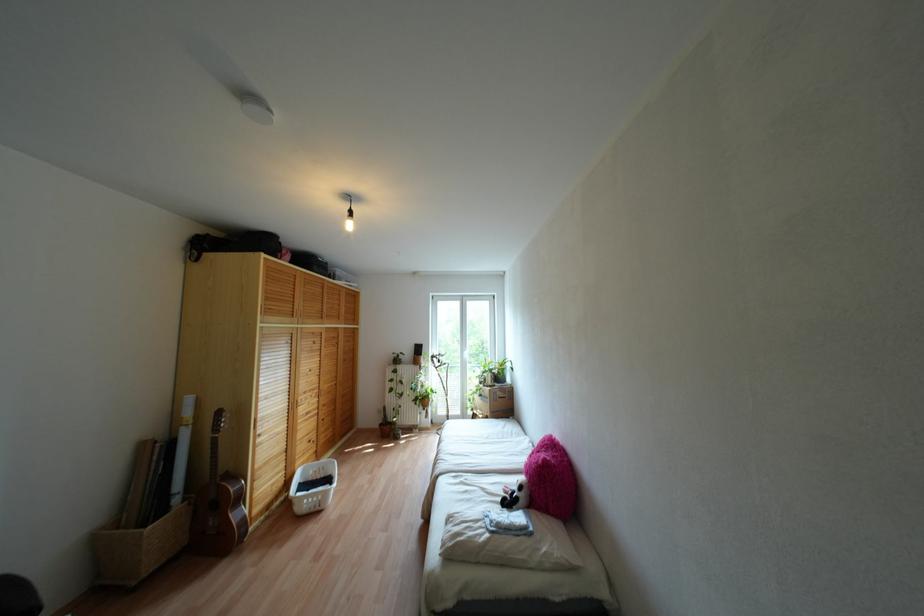
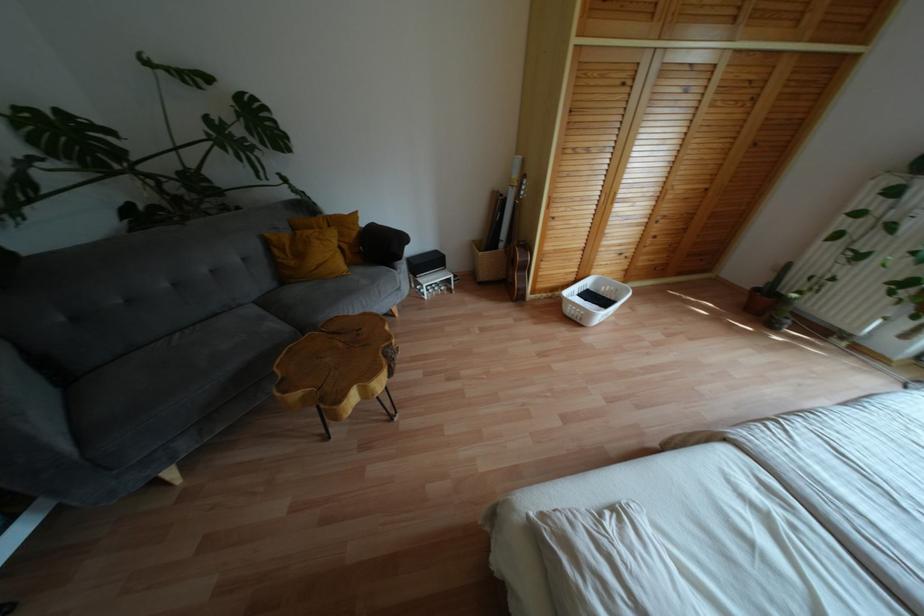
Where in the second image is the point corresponding to (x=311, y=509) from the first image?

(573, 318)